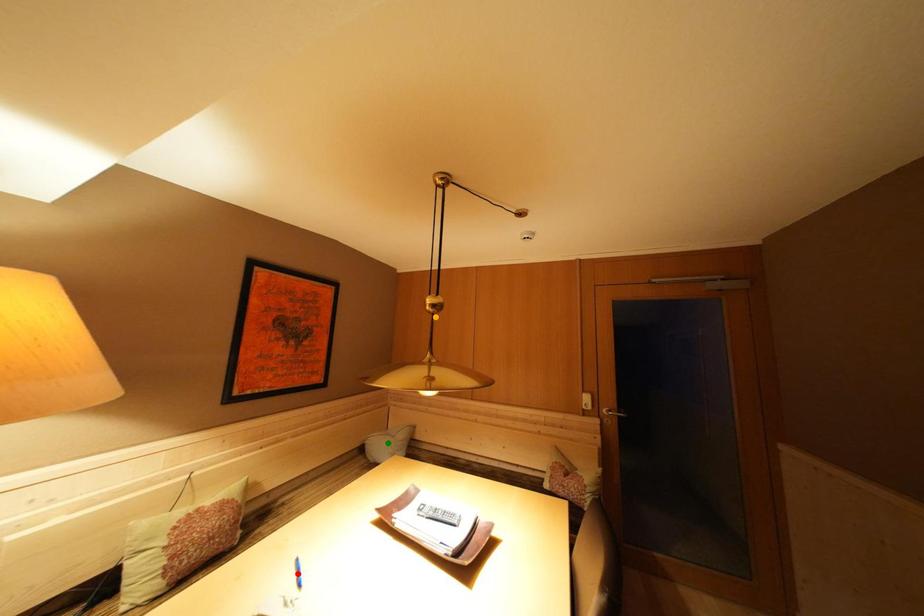
Order these from farthest to nearest:
- red point
- green point
- orange point

green point, orange point, red point